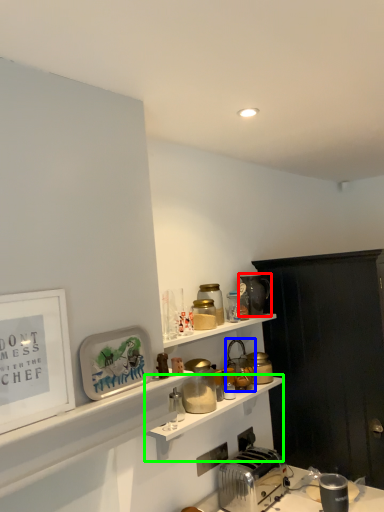
Question: Considering the real-world distances, which object is closest to appliance (highlighted by a red box)? appliance (highlighted by a blue box) or shelf (highlighted by a green box).

Choices:
 (A) appliance
 (B) shelf

Answer: (A)